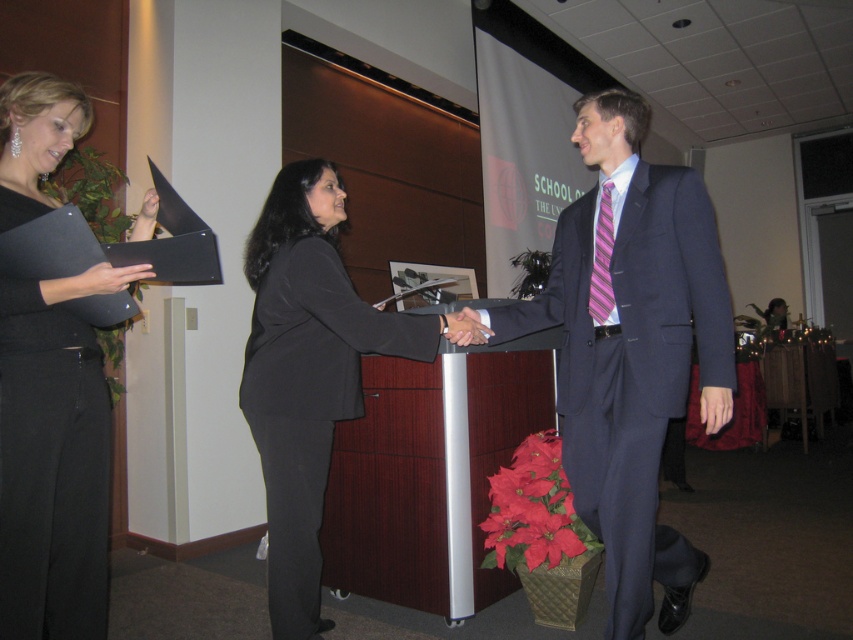
You are attending a formal event and need to take a photo of the two individuals shaking hands. Which object, the black matte suit at center or the pink striped tie at center, will appear larger in your photo due to its proximity?

The black matte suit at center will appear larger in the photo because it is closer to the viewer than the pink striped tie at center.

In the scene, there is a point marked at coordinates (631, 353). What object is located exactly at that point?

The object at point (631, 353) is the matte black suit at center.